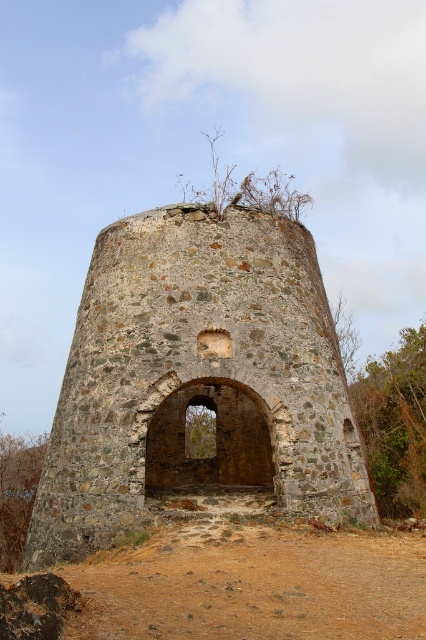
You are an archaeologist examining the ancient stone structure. You notice the rustic stone tower at center and the brown sandy soil at center. Which object is taller?

The rustic stone tower at center is taller than the brown sandy soil at center.